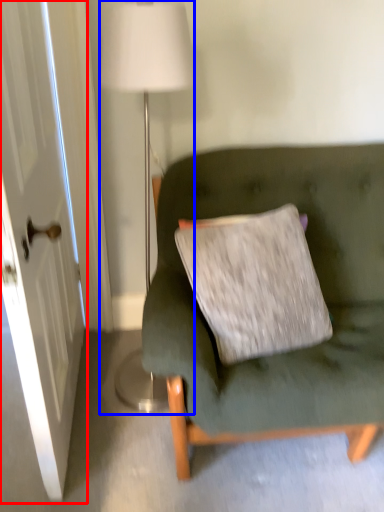
Question: Which point is further to the camera, door (highlighted by a red box) or lamp (highlighted by a blue box)?

Choices:
 (A) door
 (B) lamp

Answer: (B)